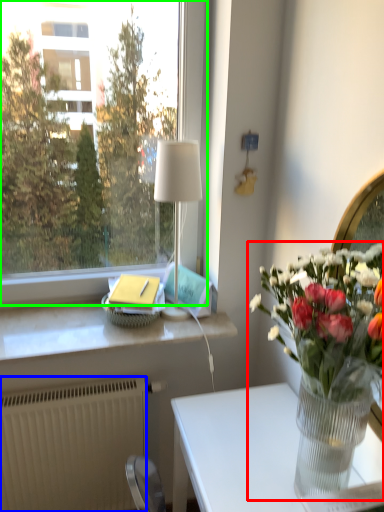
Question: Which object is the closest to the houseplant (highlighted by a red box)? Choose among these: radiator (highlighted by a blue box) or window (highlighted by a green box).

Choices:
 (A) radiator
 (B) window

Answer: (A)